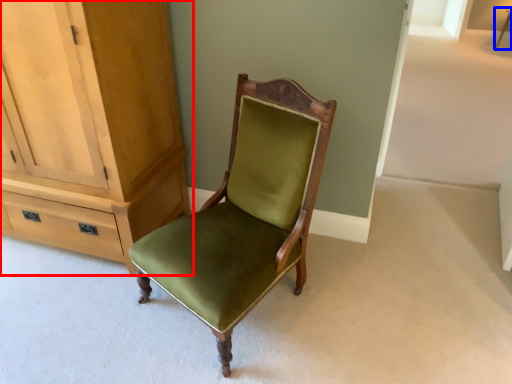
Question: Among these objects, which one is nearest to the camera, cabinetry (highlighted by a red box) or side table (highlighted by a blue box)?

Choices:
 (A) cabinetry
 (B) side table

Answer: (A)